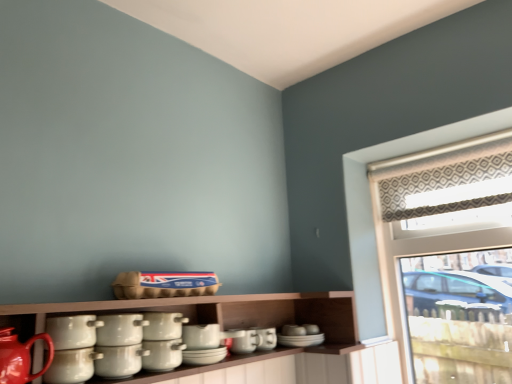
Question: Is patterned fabric at upper right in front of or behind matte red teapot at lower left in the image?

Choices:
 (A) behind
 (B) front

Answer: (A)

Question: Considering the positions of point (390, 268) and point (11, 344), is point (390, 268) closer or farther from the camera than point (11, 344)?

Choices:
 (A) closer
 (B) farther

Answer: (B)

Question: Estimate the real-world distances between objects in this image. Which object is farther from the white glossy pots at center, marked as the fifth tableware in a front-to-back arrangement?

Choices:
 (A) white glossy cup at left, which is the 9th tableware in back-to-front order
 (B) matte ceramic cup at center, which is the 9th tableware from front to back
 (C) white ceramic pot at center, marked as the 4th tableware in a back-to-front arrangement
 (D) white glossy pot at lower left, the eighth tableware viewed from the back
 (E) white glossy pot at center, acting as the fourth tableware starting from the front

Answer: (B)

Question: Which of these objects is positioned farthest from the white glossy pot at lower left, the eighth tableware viewed from the back?

Choices:
 (A) white glossy cup at left, acting as the first tableware starting from the front
 (B) matte white cup at center, which is the 8th tableware in front-to-back order
 (C) white glossy pot at center, placed as the sixth tableware when sorted from back to front
 (D) white ceramic pot at center, the sixth tableware in the front-to-back sequence
 (E) white glossy pots at center, the seventh tableware when ordered from back to front

Answer: (B)